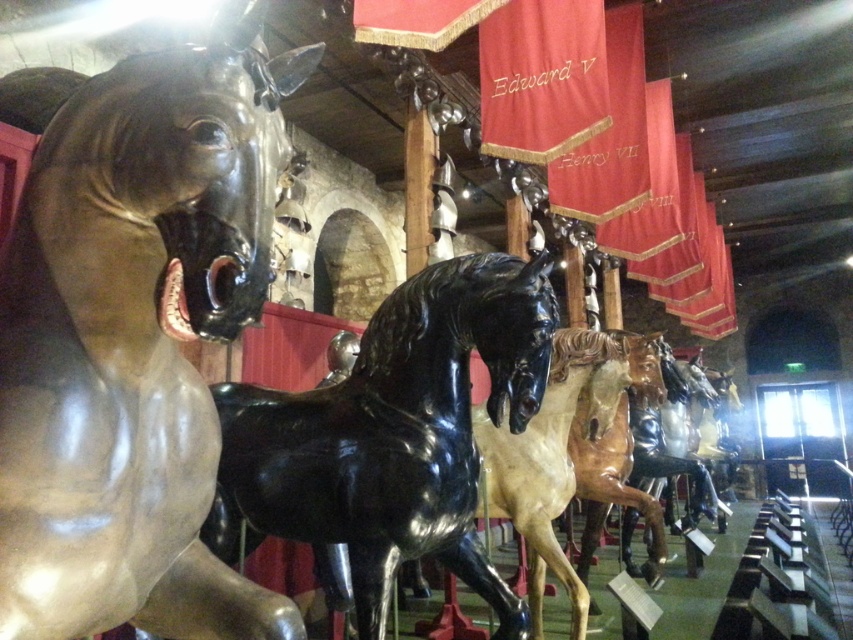
You are a visitor in the museum and want to take a photo of the shiny bronze horse at left and the glossy black horse at center. Which horse will appear larger in your photo?

The shiny bronze horse at left will appear larger in your photo because it is in front of the glossy black horse at center, making it closer to the camera.

You are an art curator planning to rearrange the shiny bronze horse at left and the glossy black horse at center for a new exhibit. If you want to place both horses on the same level, what adjustment must you make based on their current positions?

The shiny bronze horse at left is currently located above the glossy black horse at center. To place them on the same level, you need to lower the shiny bronze horse at left or raise the glossy black horse at center so they align horizontally.